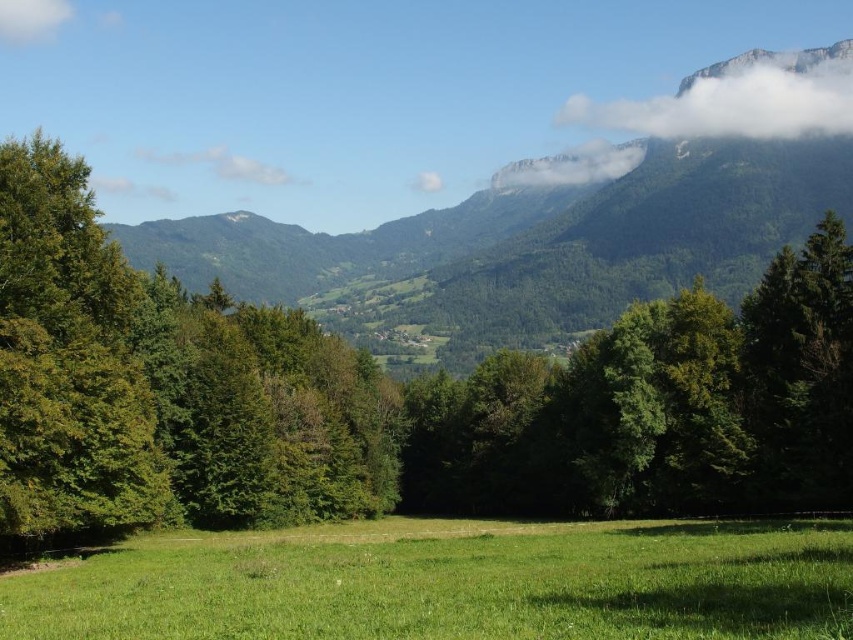
Does green leafy tree at center appear under white fluffy cloud at upper left?

Correct, green leafy tree at center is located below white fluffy cloud at upper left.

Can you confirm if green leafy tree at center is thinner than white fluffy cloud at upper left?

No.

What do you see at coordinates (390, 396) in the screenshot? I see `green leafy tree at center` at bounding box center [390, 396].

Locate an element on the screen. Image resolution: width=853 pixels, height=640 pixels. green leafy tree at center is located at coordinates (390, 396).

Can you confirm if green matte tree at left is positioned to the left of white fluffy cloud at upper right?

Indeed, green matte tree at left is positioned on the left side of white fluffy cloud at upper right.

Does green matte tree at left appear on the right side of white fluffy cloud at upper right?

No, green matte tree at left is not to the right of white fluffy cloud at upper right.

Who is more distant from viewer, (0, 353) or (640, 104)?

The point (640, 104) is behind.

Where is `green matte tree at left`? This screenshot has height=640, width=853. green matte tree at left is located at coordinates (68, 358).

Who is positioned more to the right, green leafy tree at center or green grassy field at center?

green leafy tree at center is more to the right.

Is point (149, 452) behind point (248, 572)?

That is True.

Where is `green leafy tree at center`? green leafy tree at center is located at coordinates (390, 396).